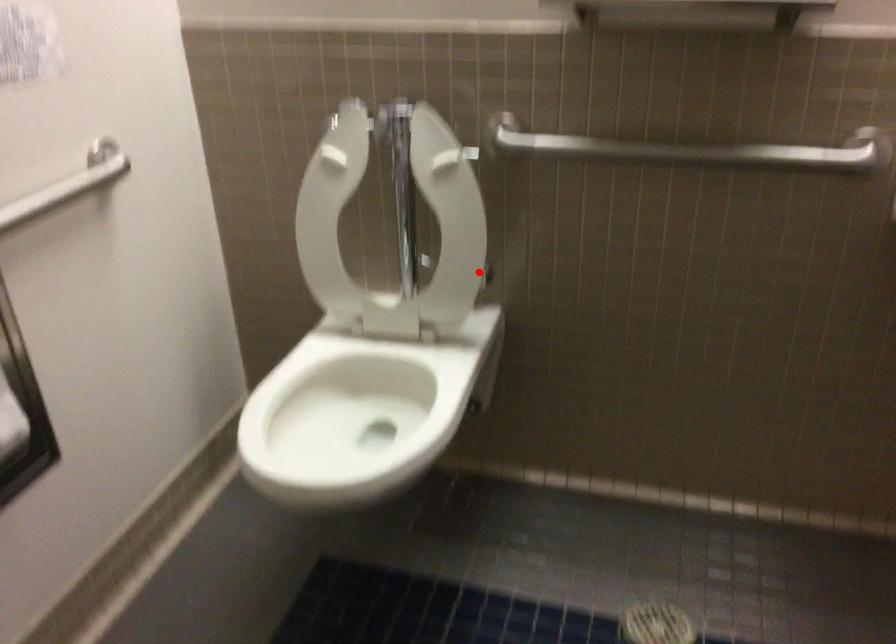
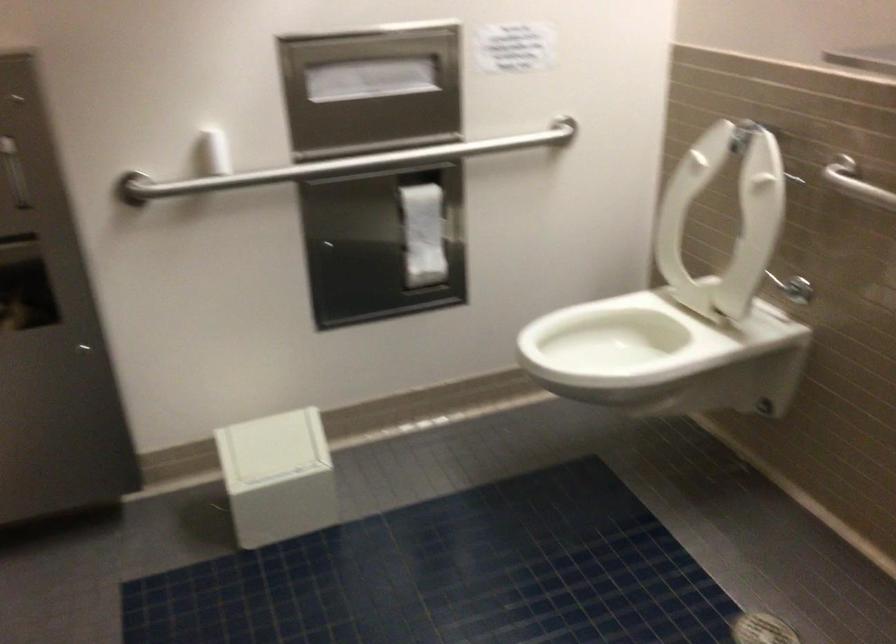
In the second image, find the point that corresponds to the highlighted location in the first image.

(793, 288)